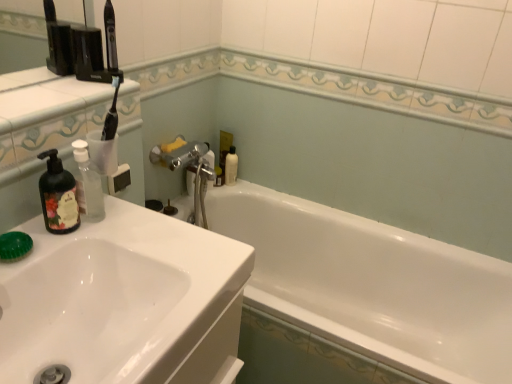
Describe the element at coordinates (124, 301) in the screenshot. The height and width of the screenshot is (384, 512). I see `white glossy sink at left` at that location.

What do you see at coordinates (58, 196) in the screenshot?
I see `matte black soap dispenser at left` at bounding box center [58, 196].

What do you see at coordinates (88, 185) in the screenshot? The width and height of the screenshot is (512, 384). I see `clear plastic bottle at left` at bounding box center [88, 185].

The height and width of the screenshot is (384, 512). What do you see at coordinates (360, 297) in the screenshot?
I see `white glossy bathtub at center` at bounding box center [360, 297].

You are a GUI agent. You are given a task and a screenshot of the screen. Output one action in this format:
    pyautogui.click(x=<x>, y=<y>)
    Task: Click on the white glossy sink at left
    This screenshot has width=512, height=384.
    Given the screenshot: What is the action you would take?
    (124, 301)

From a real-world perspective, is translucent plastic bottle at upper center above or below matte black soap dispenser at left?

Clearly, from a real-world perspective, translucent plastic bottle at upper center is below matte black soap dispenser at left.

Between point (228, 156) and point (76, 205), which one is positioned in front?

The point (76, 205) is in front.

Considering the relative sizes of translucent plastic bottle at upper center and matte black soap dispenser at left in the image provided, is translucent plastic bottle at upper center shorter than matte black soap dispenser at left?

Correct, translucent plastic bottle at upper center is not as tall as matte black soap dispenser at left.

Does translucent plastic bottle at upper center come in front of matte black soap dispenser at left?

No, translucent plastic bottle at upper center is further to the viewer.

Can you confirm if matte black soap dispenser at left is wider than white glossy sink at left?

No.

Is matte black soap dispenser at left not close to white glossy sink at left?

They are positioned close to each other.

Between matte black soap dispenser at left and white glossy sink at left, which one is positioned in front?

white glossy sink at left.

Looking at this image, which is less distant, (229, 178) or (452, 253)?

Point (229, 178).

Which is in front, translucent plastic bottle at upper center or white glossy bathtub at center?

white glossy bathtub at center is more forward.

Between translucent plastic bottle at upper center and white glossy bathtub at center, which one has more height?

white glossy bathtub at center is taller.

Consider the image. Is translucent plastic bottle at upper center looking in the opposite direction of white glossy bathtub at center?

No, translucent plastic bottle at upper center is not facing away from white glossy bathtub at center.

In terms of width, does white glossy bathtub at center look wider or thinner when compared to translucent plastic bottle at upper center?

Clearly, white glossy bathtub at center has more width compared to translucent plastic bottle at upper center.

Considering the sizes of objects white glossy bathtub at center and translucent plastic bottle at upper center in the image provided, who is bigger, white glossy bathtub at center or translucent plastic bottle at upper center?

Bigger between the two is white glossy bathtub at center.

From a real-world perspective, relative to translucent plastic bottle at upper center, is white glossy bathtub at center vertically above or below?

Clearly, from a real-world perspective, white glossy bathtub at center is below translucent plastic bottle at upper center.

How many degrees apart are the facing directions of translucent plastic bottle at upper center and white glossy sink at left?

The angle between the facing direction of translucent plastic bottle at upper center and the facing direction of white glossy sink at left is 1.02 degrees.

From the image's perspective, which one is positioned higher, translucent plastic bottle at upper center or white glossy sink at left?

translucent plastic bottle at upper center appears higher in the image.

Are translucent plastic bottle at upper center and white glossy sink at left far apart?

Yes, translucent plastic bottle at upper center and white glossy sink at left are quite far apart.

Based on the photo, does translucent plastic bottle at upper center have a larger size compared to white glossy sink at left?

No.

Is clear plastic bottle at left to the left of translucent plastic bottle at upper center from the viewer's perspective?

Indeed, clear plastic bottle at left is positioned on the left side of translucent plastic bottle at upper center.

You are a GUI agent. You are given a task and a screenshot of the screen. Output one action in this format:
    pyautogui.click(x=<x>, y=<y>)
    Task: Click on the bottle that appears in front of the translucent plastic bottle at upper center
    
    Given the screenshot: What is the action you would take?
    pyautogui.click(x=88, y=185)

Between clear plastic bottle at left and translucent plastic bottle at upper center, which one has larger width?

clear plastic bottle at left.

Considering the sizes of objects clear plastic bottle at left and translucent plastic bottle at upper center in the image provided, who is taller, clear plastic bottle at left or translucent plastic bottle at upper center?

clear plastic bottle at left is taller.

Is white glossy bathtub at center positioned in front of matte black soap dispenser at left?

No.

Is the surface of white glossy bathtub at center in direct contact with matte black soap dispenser at left?

white glossy bathtub at center and matte black soap dispenser at left are not in contact.

Between white glossy bathtub at center and matte black soap dispenser at left, which one has smaller size?

Smaller between the two is matte black soap dispenser at left.

You are a GUI agent. You are given a task and a screenshot of the screen. Output one action in this format:
    pyautogui.click(x=<x>, y=<y>)
    Task: Click on the mouthwash on the right of matte black soap dispenser at left
    The height and width of the screenshot is (384, 512).
    Given the screenshot: What is the action you would take?
    pyautogui.click(x=231, y=166)

The width and height of the screenshot is (512, 384). In order to click on sink in front of the matte black soap dispenser at left in this screenshot , I will do `click(124, 301)`.

From the image, which object appears to be farther from matte black soap dispenser at left, white glossy sink at left or translucent plastic bottle at upper center?

translucent plastic bottle at upper center is further to matte black soap dispenser at left.

Looking at the image, which one is located closer to translucent plastic bottle at upper center, white glossy sink at left or white glossy bathtub at center?

white glossy bathtub at center is positioned closer to the anchor translucent plastic bottle at upper center.

From the image, which object appears to be farther from clear plastic bottle at left, white glossy sink at left or matte black soap dispenser at left?

white glossy sink at left lies further to clear plastic bottle at left than the other object.

From the image, which object appears to be farther from white glossy bathtub at center, translucent plastic bottle at upper center or matte black soap dispenser at left?

Based on the image, matte black soap dispenser at left appears to be further to white glossy bathtub at center.

Based on their spatial positions, is translucent plastic bottle at upper center or clear plastic bottle at left closer to white glossy sink at left?

The object closer to white glossy sink at left is clear plastic bottle at left.

Estimate the real-world distances between objects in this image. Which object is further from translucent plastic bottle at upper center, white glossy sink at left or clear plastic bottle at left?

white glossy sink at left lies further to translucent plastic bottle at upper center than the other object.

Based on their spatial positions, is white glossy sink at left or matte black soap dispenser at left further from white glossy bathtub at center?

matte black soap dispenser at left is further to white glossy bathtub at center.

Looking at the image, which one is located closer to white glossy bathtub at center, matte black soap dispenser at left or translucent plastic bottle at upper center?

The object closer to white glossy bathtub at center is translucent plastic bottle at upper center.

Locate an element on the screen. bottle positioned between matte black soap dispenser at left and translucent plastic bottle at upper center from near to far is located at coordinates (88, 185).

Find the location of `bottle positioned between white glossy sink at left and translucent plastic bottle at upper center from near to far`. bottle positioned between white glossy sink at left and translucent plastic bottle at upper center from near to far is located at coordinates (88, 185).

Where is `soap dispenser located between white glossy sink at left and translucent plastic bottle at upper center in the depth direction`? The width and height of the screenshot is (512, 384). soap dispenser located between white glossy sink at left and translucent plastic bottle at upper center in the depth direction is located at coordinates (58, 196).

At what (x,y) coordinates should I click in order to perform the action: click on bathtub positioned between clear plastic bottle at left and translucent plastic bottle at upper center from near to far. Please return your answer as a coordinate pair (x, y). The image size is (512, 384). Looking at the image, I should click on (360, 297).